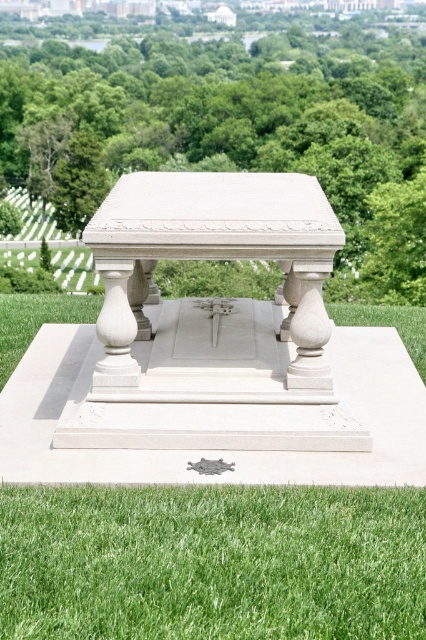
Question: Does white stone bench at center have a larger size compared to green grass at lower center?

Choices:
 (A) yes
 (B) no

Answer: (A)

Question: Does white stone bench at center have a smaller size compared to green grass at lower center?

Choices:
 (A) yes
 (B) no

Answer: (B)

Question: Among these objects, which one is farthest from the camera?

Choices:
 (A) white stone bench at center
 (B) green grass at lower center

Answer: (A)

Question: In this image, where is white stone bench at center located relative to green grass at lower center?

Choices:
 (A) left
 (B) right

Answer: (B)